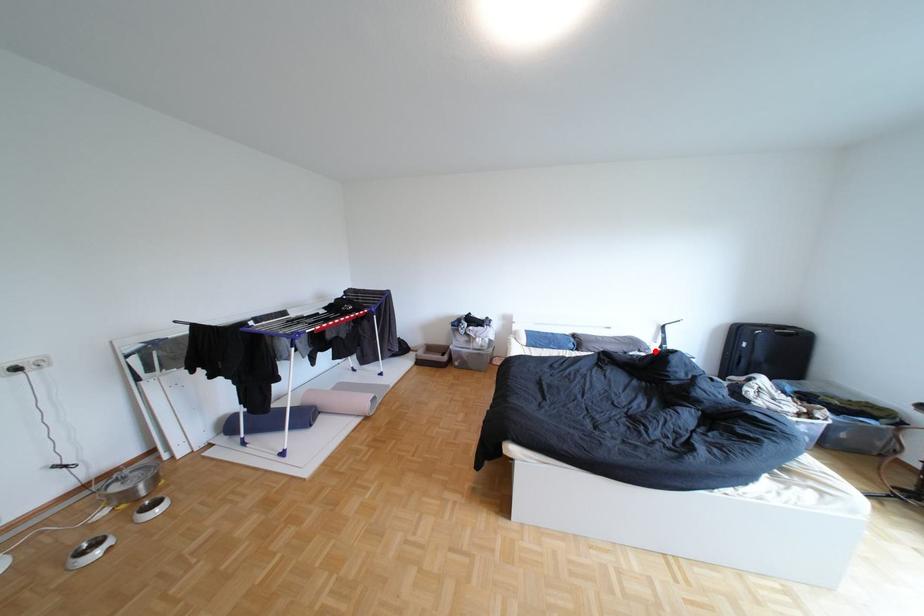
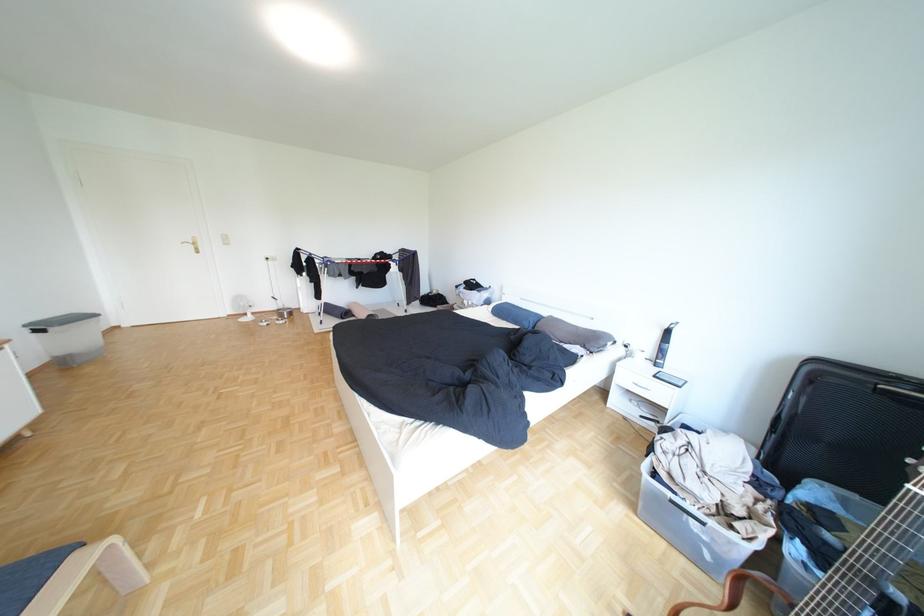
Find the pixel in the second image that matches the highlighted location in the first image.

(600, 347)